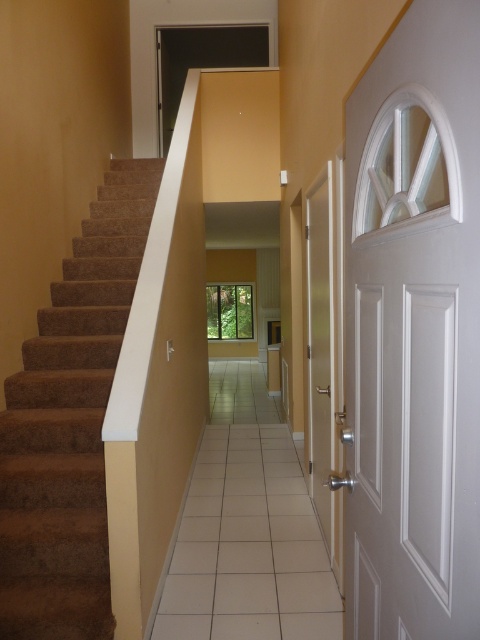
Question: Is brown carpeted stairs at left smaller than white glossy door at center?

Choices:
 (A) yes
 (B) no

Answer: (B)

Question: Among these objects, which one is farthest from the camera?

Choices:
 (A) white glossy door at center
 (B) brown carpeted stairs at left

Answer: (A)

Question: Is brown carpeted stairs at left smaller than white glossy door at center?

Choices:
 (A) no
 (B) yes

Answer: (A)

Question: Does brown carpeted stairs at left come behind white glossy door at center?

Choices:
 (A) no
 (B) yes

Answer: (A)

Question: Which point is closer to the camera taking this photo?

Choices:
 (A) (310, 282)
 (B) (123, 291)

Answer: (A)